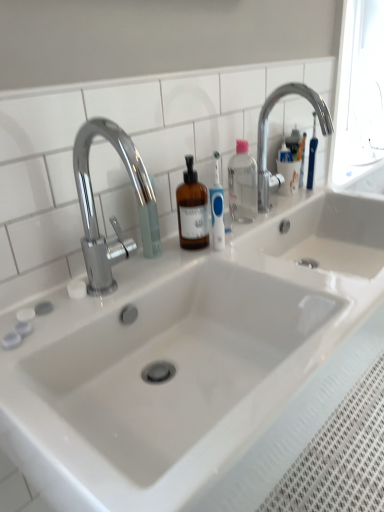
Identify the location of vacant location below chrome metallic faucet at upper right, which appears as the 2th tap when viewed from the front (from a real-world perspective). (286, 203).